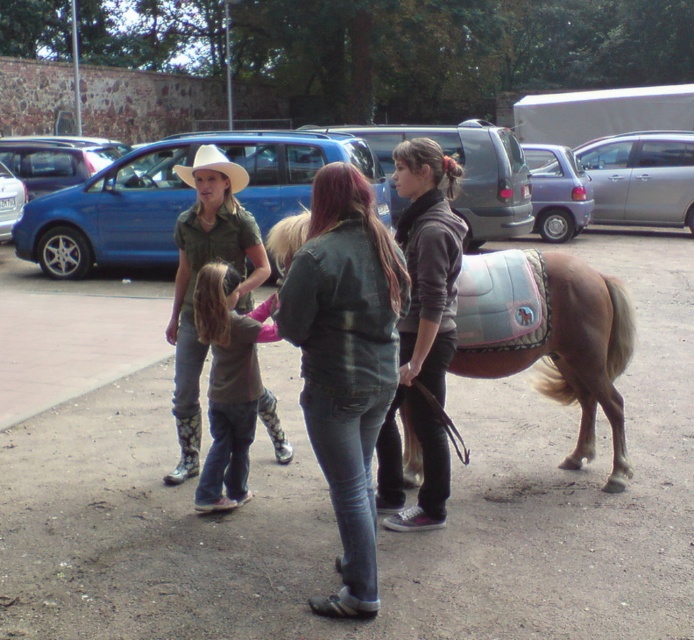
Question: Among these objects, which one is nearest to the camera?

Choices:
 (A) brown denim pants at center
 (B) light brown leather saddle at lower right
 (C) matte white cowboy hat at upper center

Answer: (A)

Question: Does dark gray fleece hoodie at center have a larger size compared to matte green shirt at center?

Choices:
 (A) no
 (B) yes

Answer: (A)

Question: Which object is closer to the camera taking this photo?

Choices:
 (A) matte white cowboy hat at upper center
 (B) matte green shirt at center
 (C) brown denim pants at center

Answer: (C)

Question: Does dark gray fleece hoodie at center appear on the left side of matte white cowboy hat at upper center?

Choices:
 (A) yes
 (B) no

Answer: (B)

Question: Observing the image, what is the correct spatial positioning of dark gray fleece hoodie at center in reference to matte green shirt at center?

Choices:
 (A) right
 (B) left

Answer: (A)

Question: Among these objects, which one is farthest from the camera?

Choices:
 (A) matte green shirt at center
 (B) brown denim pants at center

Answer: (A)